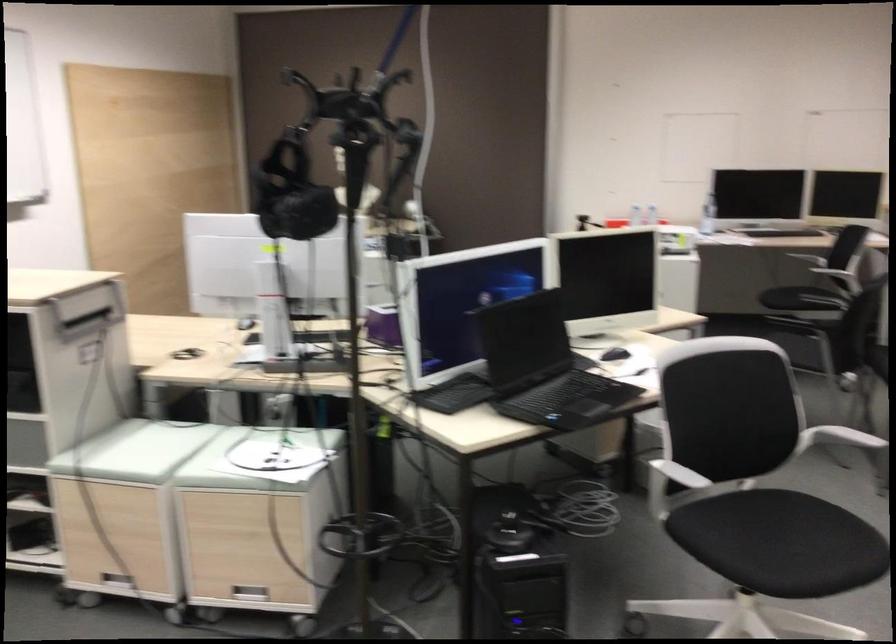
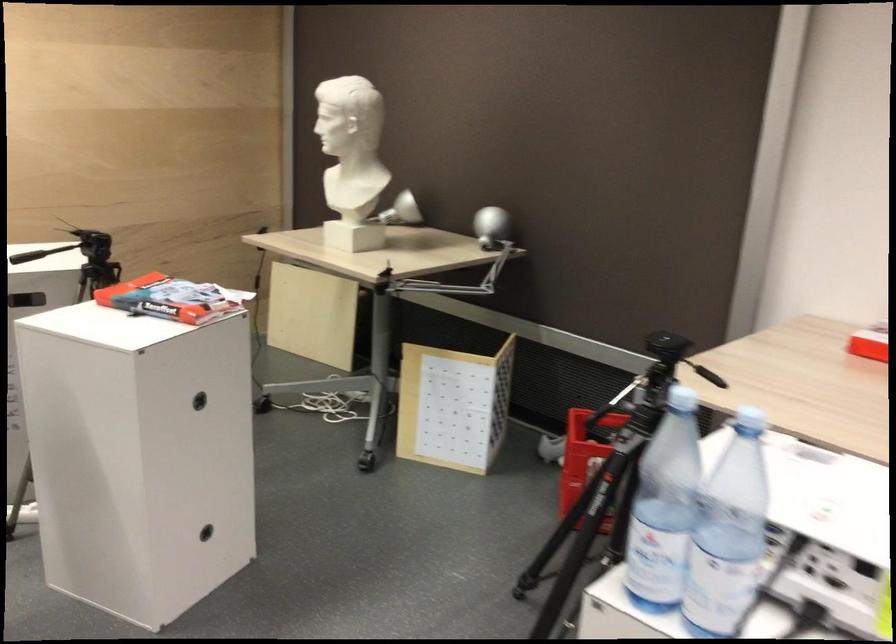
Question: Which direction would the cameraman need to move to produce the second image? Reply with the corresponding letter.

Choices:
 (A) Left
 (B) Right
 (C) Forward
 (D) Backward

Answer: (C)